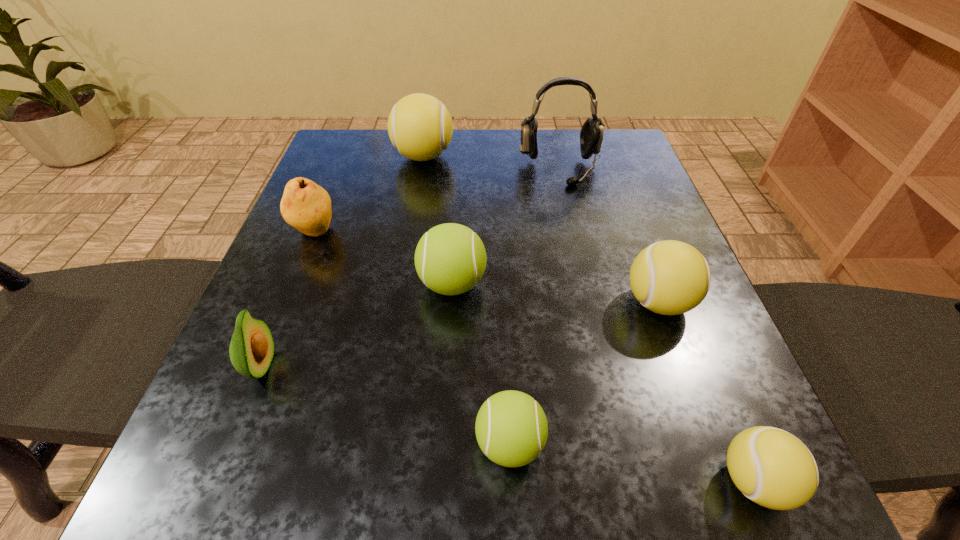
The height and width of the screenshot is (540, 960). In order to click on the tallest object in this screenshot , I will do `click(591, 135)`.

I want to click on the farthest tennis ball, so click(x=420, y=127).

Where is `the farthest yellow tennis ball`? the farthest yellow tennis ball is located at coordinates (420, 127).

At what (x,y) coordinates should I click in order to perform the action: click on pear. Please return your answer as a coordinate pair (x, y). This screenshot has height=540, width=960. Looking at the image, I should click on (306, 206).

At what (x,y) coordinates should I click in order to perform the action: click on the farther green tennis ball. Please return your answer as a coordinate pair (x, y). This screenshot has width=960, height=540. Looking at the image, I should click on (450, 259).

At what (x,y) coordinates should I click in order to perform the action: click on the second biggest yellow tennis ball. Please return your answer as a coordinate pair (x, y). Looking at the image, I should click on (670, 277).

This screenshot has height=540, width=960. Find the location of `avocado`. avocado is located at coordinates (251, 350).

The height and width of the screenshot is (540, 960). I want to click on green avocado, so click(251, 350).

Where is `the nearer green tennis ball`? This screenshot has width=960, height=540. the nearer green tennis ball is located at coordinates (511, 428).

The height and width of the screenshot is (540, 960). Identify the location of the smallest yellow tennis ball. (773, 468).